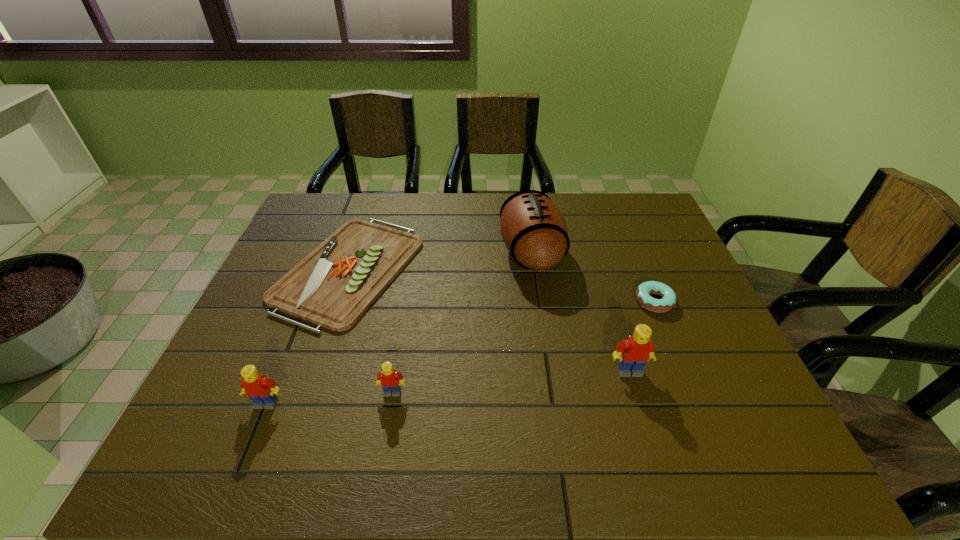
At what (x,y) coordinates should I click in order to perform the action: click on the nearest Lego. Please return your answer as a coordinate pair (x, y). This screenshot has height=540, width=960. Looking at the image, I should click on (262, 391).

Find the location of a particular element. The image size is (960, 540). the leftmost Lego is located at coordinates point(262,391).

The width and height of the screenshot is (960, 540). I want to click on the shortest Lego, so (391, 381).

This screenshot has width=960, height=540. What are the coordinates of `the fifth farthest object` in the screenshot? It's located at (391, 381).

Locate an element on the screen. The height and width of the screenshot is (540, 960). the third nearest object is located at coordinates (633, 353).

In order to click on the farthest Lego in this screenshot , I will do `click(633, 353)`.

Image resolution: width=960 pixels, height=540 pixels. In order to click on football (American) in this screenshot , I will do coord(534,231).

At what (x,y) coordinates should I click in order to perform the action: click on chopping board. Please return your answer as a coordinate pair (x, y). Looking at the image, I should click on (333, 286).

The image size is (960, 540). What are the coordinates of `the rightmost object` in the screenshot? It's located at (668, 301).

Locate an element on the screen. This screenshot has height=540, width=960. free location located 0.090m on the front-facing side of the rightmost Lego is located at coordinates (642, 413).